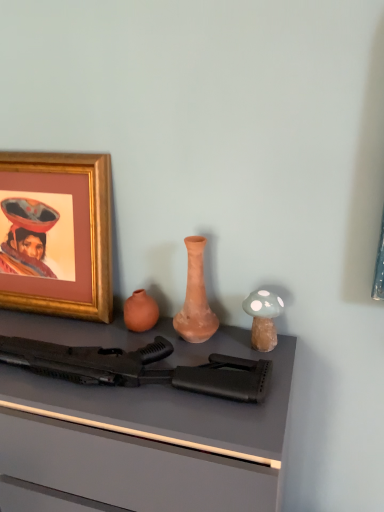
Question: Relative to black matte rifle at center, is gold-framed picture at upper left in front or behind?

Choices:
 (A) behind
 (B) front

Answer: (A)

Question: From the image's perspective, is gold-framed picture at upper left above or below black matte rifle at center?

Choices:
 (A) below
 (B) above

Answer: (B)

Question: Which is nearer to the gold-framed picture at upper left?

Choices:
 (A) matte clay vase at center
 (B) matte black rifle at center
 (C) black matte rifle at center

Answer: (B)

Question: Which object is the closest to the gold-framed picture at upper left?

Choices:
 (A) matte clay vase at center
 (B) matte black rifle at center
 (C) black matte rifle at center

Answer: (B)